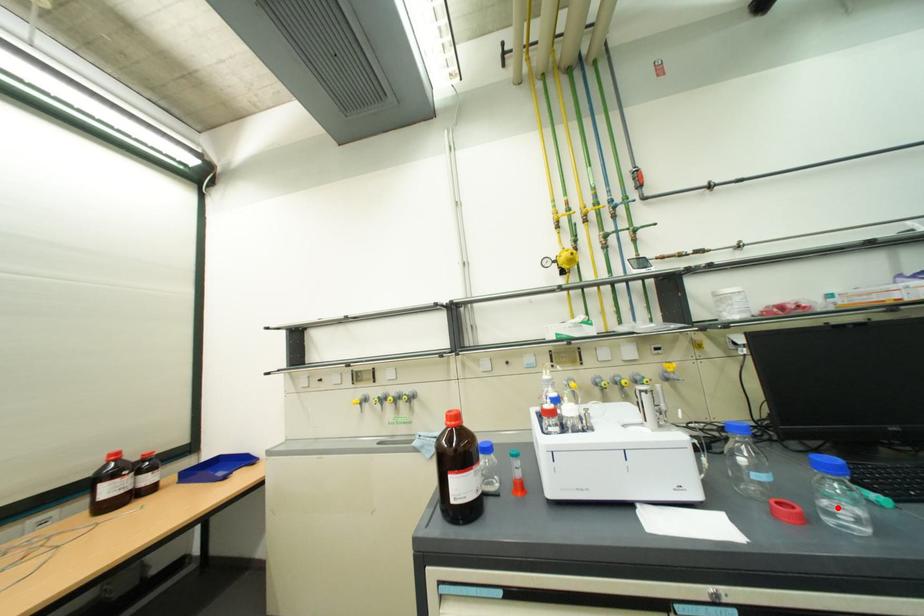
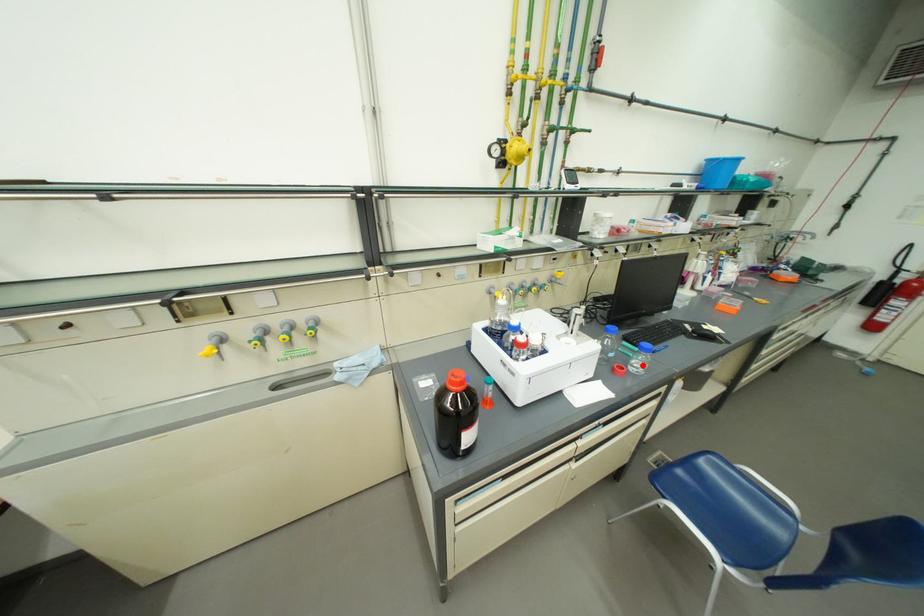
I am providing you with two images of the same scene from different viewpoints. A red point is marked on the first image and another point is marked on the second image. Do the highlighted points in image1 and image2 indicate the same real-world spot?

Yes